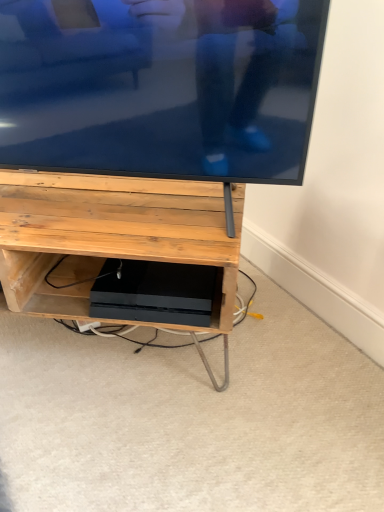
This screenshot has height=512, width=384. Identify the location of empty space that is ontop of black matte console at center. (152, 274).